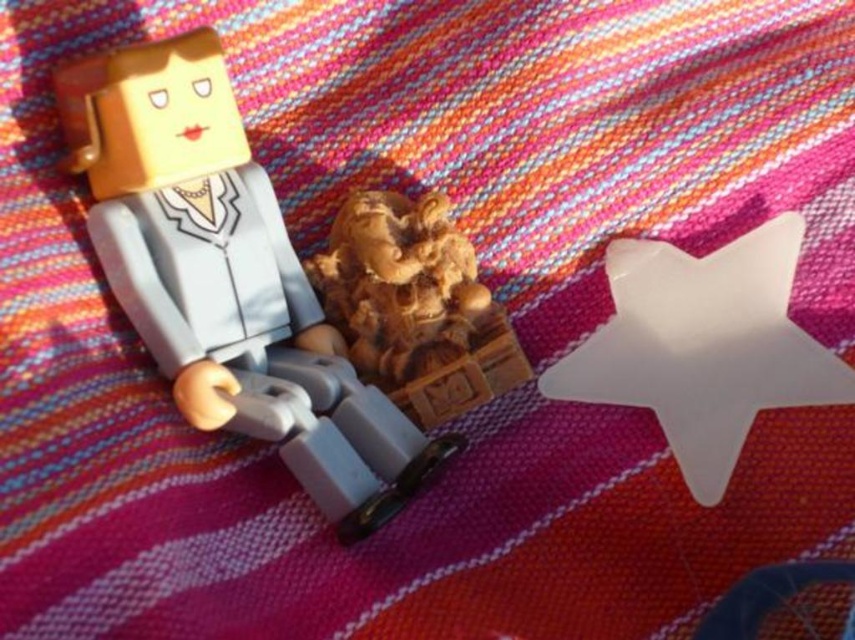
Question: From the image, what is the correct spatial relationship of matte plastic robot at upper left in relation to white matte star at upper right?

Choices:
 (A) right
 (B) left

Answer: (B)

Question: Which point is farther to the camera?

Choices:
 (A) matte plastic robot at upper left
 (B) white matte star at upper right

Answer: (B)

Question: Can you confirm if white matte star at upper right is thinner than wooden carving at center?

Choices:
 (A) yes
 (B) no

Answer: (B)

Question: Which of these objects is positioned closest to the wooden carving at center?

Choices:
 (A) matte plastic robot at upper left
 (B) white matte star at upper right

Answer: (A)

Question: Considering the real-world distances, which object is farthest from the wooden carving at center?

Choices:
 (A) matte plastic robot at upper left
 (B) white matte star at upper right

Answer: (B)

Question: Is white matte star at upper right above wooden carving at center?

Choices:
 (A) no
 (B) yes

Answer: (A)